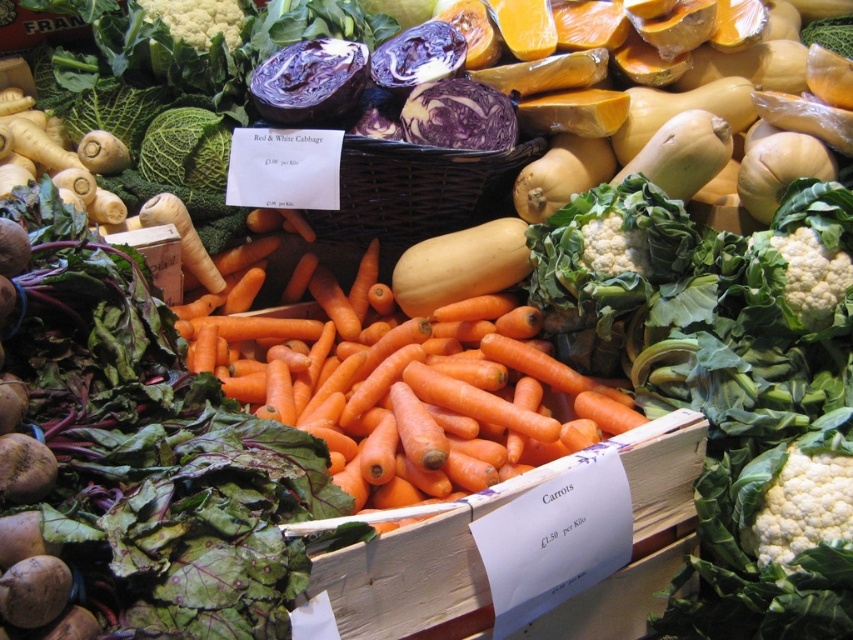
Is green leafy cabbage at upper left below green leafy broccoli at upper left?

Indeed, green leafy cabbage at upper left is positioned under green leafy broccoli at upper left.

Is point (177, 163) closer to viewer compared to point (144, 13)?

Yes, point (177, 163) is closer to viewer.

This screenshot has width=853, height=640. Find the location of `green leafy cabbage at upper left`. green leafy cabbage at upper left is located at coordinates (186, 148).

Which is in front, point (421, 488) or point (181, 38)?

Point (421, 488)

Who is more forward, [363,483] or [236,16]?

Point [363,483] is more forward.

Locate an element on the screen. The width and height of the screenshot is (853, 640). orange matte carrots at center is located at coordinates (412, 396).

Identify the location of orange matte carrots at center. (412, 396).

Looking at this image, between orange matte carrots at center and green leafy cabbage at upper left, which one has less height?

With less height is green leafy cabbage at upper left.

Between point (564, 380) and point (160, 150), which one is positioned behind?

Point (160, 150)

The image size is (853, 640). Find the location of `orange matte carrots at center`. orange matte carrots at center is located at coordinates (412, 396).